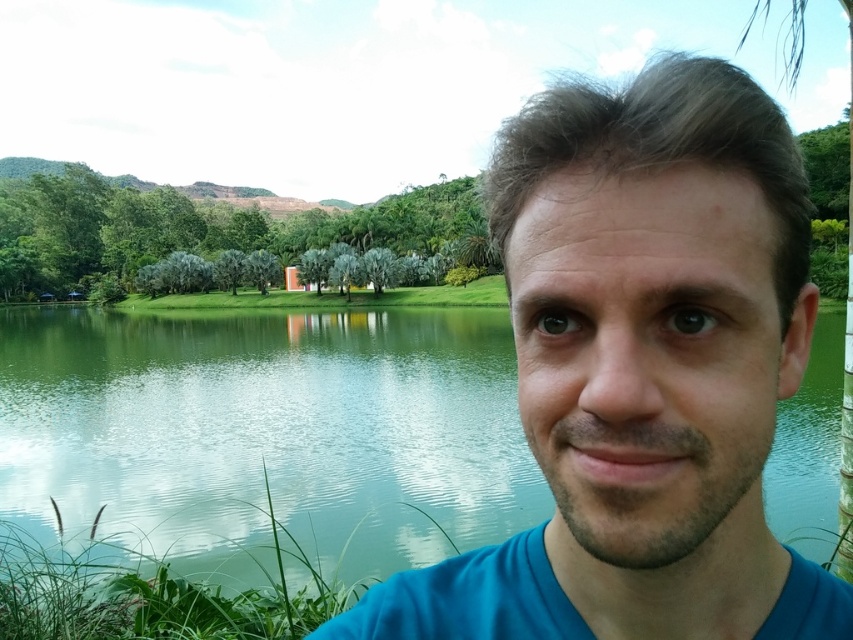
You are a photographer trying to capture the man and the water in the scene. According to the image, where is the blue fabric face at center in relation to the green smooth water at center?

The blue fabric face at center is below the green smooth water at center.

You are standing in the serene outdoor setting described. You notice two points marked in the image. The first point is at coordinates point (480,561), and the second is at point (223,499). Which of these points is nearer to you?

Point (480,561) is closer to the viewer than point (223,499).

You are a photographer trying to capture the blue fabric face at center and the green smooth water at center in the same frame. Based on the scene description, which object should appear closer to the camera in your photo?

The blue fabric face at center should appear closer to the camera because it is in front of the green smooth water at center according to the description.